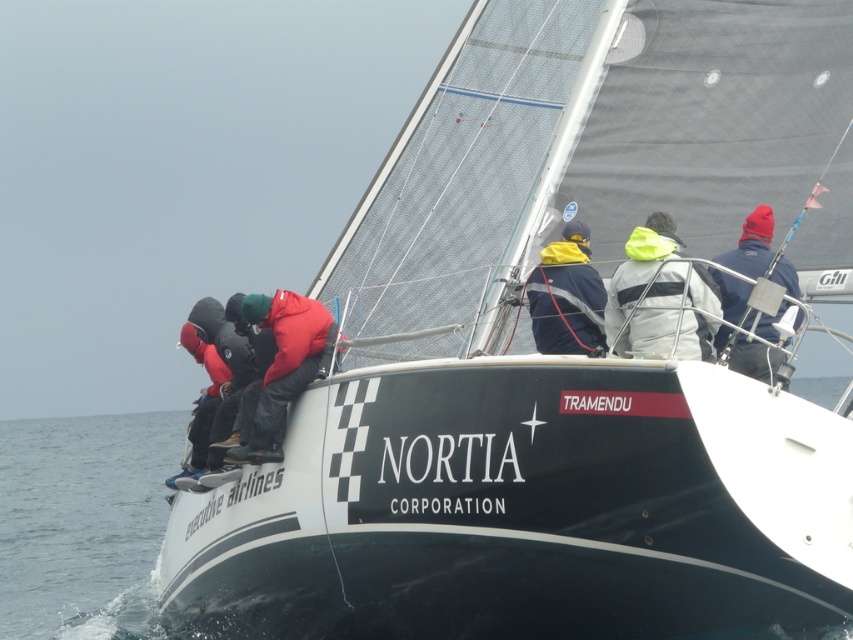
Question: Is transparent water at lower left positioned at the back of dark blue and yellow jacket at center?

Choices:
 (A) no
 (B) yes

Answer: (A)

Question: Is transparent water at lower left to the left of neon yellow jacket at center from the viewer's perspective?

Choices:
 (A) no
 (B) yes

Answer: (B)

Question: Considering the real-world distances, which object is closest to the transparent water at lower left?

Choices:
 (A) neon yellow jacket at center
 (B) blue fabric jacket at upper right
 (C) red matte jacket at center
 (D) dark blue and yellow jacket at center

Answer: (A)

Question: Which of these objects is positioned closest to the neon yellow jacket at center?

Choices:
 (A) blue fabric jacket at upper right
 (B) transparent water at lower left
 (C) dark blue and yellow jacket at center
 (D) red matte jacket at center

Answer: (C)

Question: Where is red matte jacket at center located in relation to blue fabric jacket at upper right in the image?

Choices:
 (A) left
 (B) right

Answer: (A)

Question: Which of the following is the farthest from the observer?

Choices:
 (A) blue fabric jacket at upper right
 (B) transparent water at lower left
 (C) neon yellow jacket at center

Answer: (A)